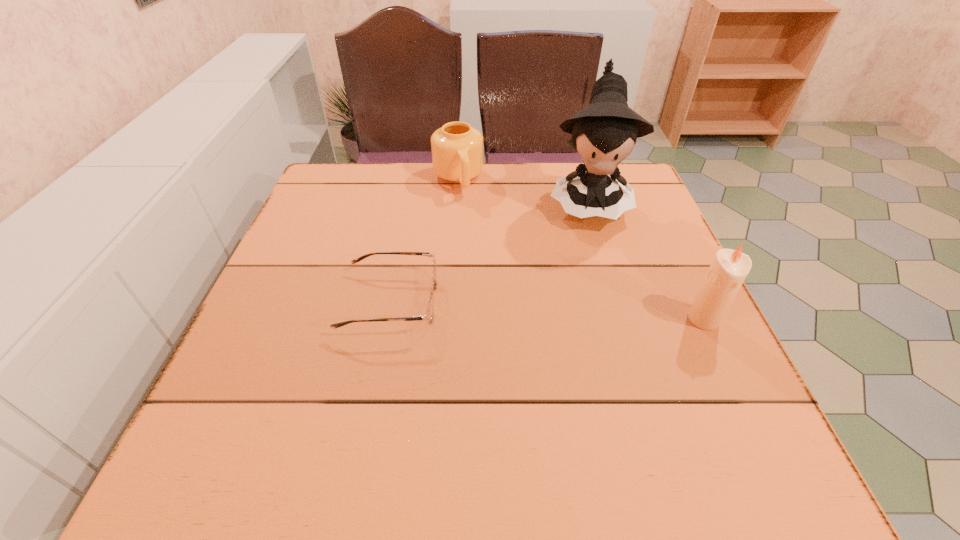
Locate an element on the screen. The width and height of the screenshot is (960, 540). free space located 0.350m at the face of the second object from right to left is located at coordinates (594, 356).

Image resolution: width=960 pixels, height=540 pixels. I want to click on free space located on the handle side of the third tallest object, so click(x=467, y=208).

Identify the location of free location located 0.060m on the handle side of the third tallest object. (468, 211).

Identify the location of blank space located on the handle side of the third tallest object. (476, 238).

In order to click on doll that is at the far edge in this screenshot , I will do `click(604, 133)`.

Image resolution: width=960 pixels, height=540 pixels. In order to click on mug at the far edge in this screenshot , I will do `click(457, 148)`.

The width and height of the screenshot is (960, 540). What are the coordinates of `candle present at the right edge` in the screenshot? It's located at (729, 268).

Identify the location of doll located in the right edge section of the desktop. (604, 133).

Where is `object present at the far right corner`? The width and height of the screenshot is (960, 540). object present at the far right corner is located at coordinates (604, 133).

Image resolution: width=960 pixels, height=540 pixels. In the image, there is a desktop. Identify the location of vacant space at the far edge. (548, 182).